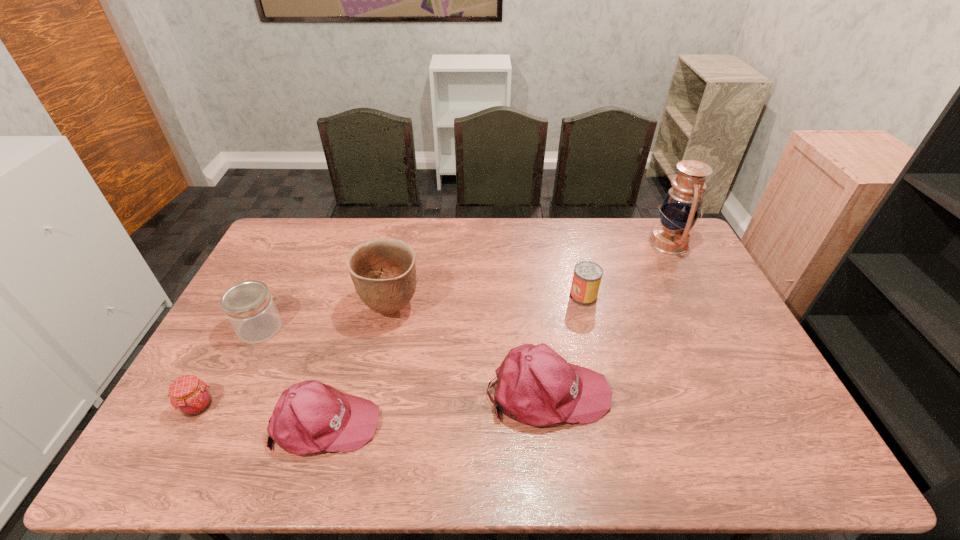
The height and width of the screenshot is (540, 960). Find the location of `object that is positioned at the near left corner`. object that is positioned at the near left corner is located at coordinates (189, 395).

Where is `object that is at the far right corner`? This screenshot has height=540, width=960. object that is at the far right corner is located at coordinates (681, 207).

Find the location of a particular element. The image size is (960, 540). vacant space at the far edge is located at coordinates (432, 240).

Identify the location of blank space at the near edge. (246, 426).

Where is `free spot at the left edge of the desktop`? This screenshot has width=960, height=540. free spot at the left edge of the desktop is located at coordinates (230, 361).

Identify the location of vacant position at the far right corner of the desktop. [x=649, y=246].

Where is `vacant area that lies between the jar and the left baseball cap`? This screenshot has width=960, height=540. vacant area that lies between the jar and the left baseball cap is located at coordinates (293, 375).

Find the location of a particular element. free space between the pottery and the jar is located at coordinates (325, 318).

Where is `empty space between the jam and the taller baseball cap`? empty space between the jam and the taller baseball cap is located at coordinates (373, 399).

Find the location of a particular element. vacant point located between the shorter baseball cap and the pottery is located at coordinates (358, 366).